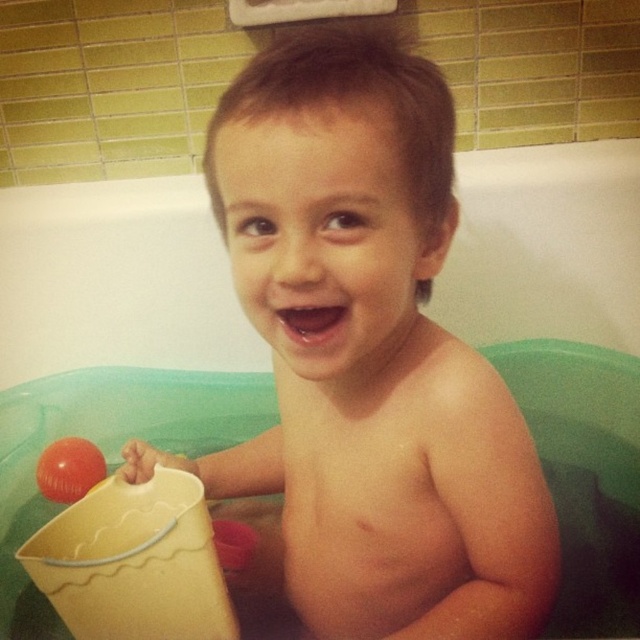
Based on the scene, where is the smooth skin child at center located in the image coordinates?

The smooth skin child at center is located at coordinates point (368, 355).

In the scene of a child in a bathtub, there is a smooth skin child at center and a rubber ball at left. Which object is taller?

The smooth skin child at center is much taller than the rubber ball at left.